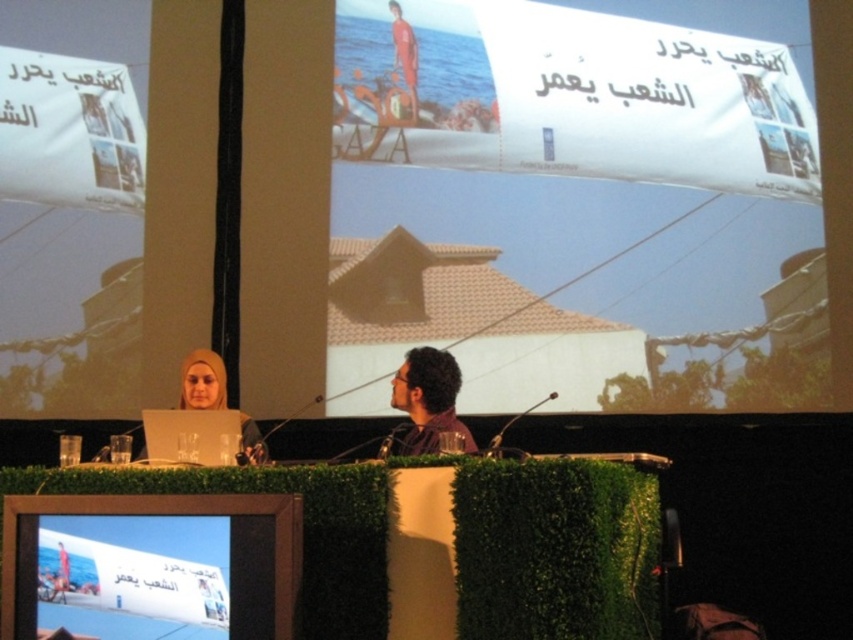
Question: Is the position of brown fabric shirt at center less distant than that of matte beige hijab at center?

Choices:
 (A) no
 (B) yes

Answer: (B)

Question: Which of the following is the closest to the observer?

Choices:
 (A) (374, 65)
 (B) (421, 435)

Answer: (B)

Question: Which point appears farthest from the camera in this image?

Choices:
 (A) (399, 307)
 (B) (416, 104)
 (C) (207, 353)
 (D) (434, 428)

Answer: (B)

Question: Among these points, which one is nearest to the camera?

Choices:
 (A) (399, 246)
 (B) (222, 376)

Answer: (B)

Question: Does white paper at upper center have a smaller size compared to matte beige hijab at center?

Choices:
 (A) no
 (B) yes

Answer: (A)

Question: Does brown fabric shirt at center appear on the left side of matte beige hijab at center?

Choices:
 (A) no
 (B) yes

Answer: (A)